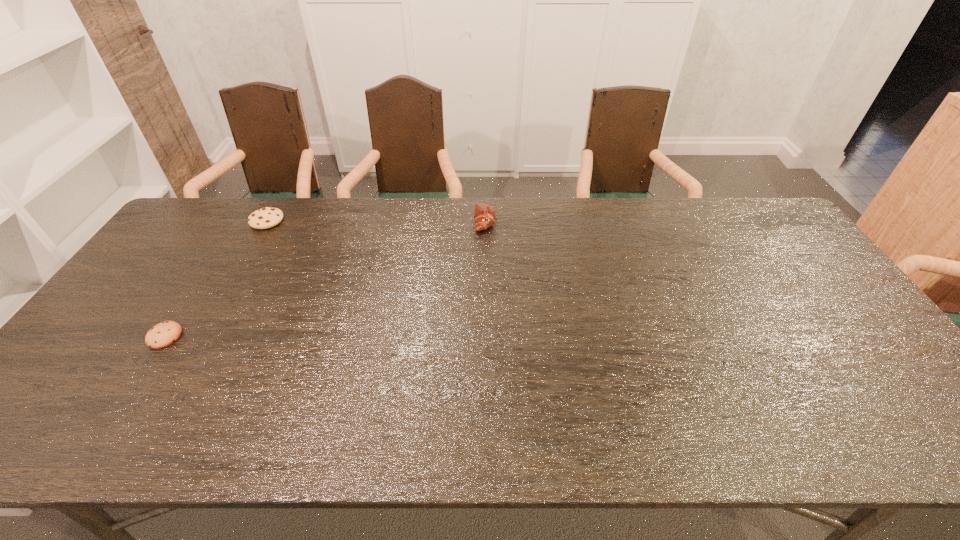
Where is `crescent roll`? crescent roll is located at coordinates (484, 216).

Find the location of a particular element. The image size is (960, 540). the rightmost object is located at coordinates (484, 216).

Where is `the second tallest object`? Image resolution: width=960 pixels, height=540 pixels. the second tallest object is located at coordinates (267, 217).

This screenshot has height=540, width=960. I want to click on the farther cookie, so click(x=267, y=217).

Image resolution: width=960 pixels, height=540 pixels. What are the coordinates of `the shortest object` in the screenshot? It's located at pos(163,334).

Find the location of a particular element. This screenshot has height=540, width=960. the nearest object is located at coordinates (163, 334).

Where is `vacant space situated on the right of the rightmost object`? The height and width of the screenshot is (540, 960). vacant space situated on the right of the rightmost object is located at coordinates (513, 221).

I want to click on free space located on the right of the taller cookie, so click(303, 220).

This screenshot has width=960, height=540. What are the coordinates of `vacant region located 0.090m on the right of the nearest object` in the screenshot? It's located at point(215,336).

Locate an element on the screen. The image size is (960, 540). crescent roll present at the far edge is located at coordinates (484, 216).